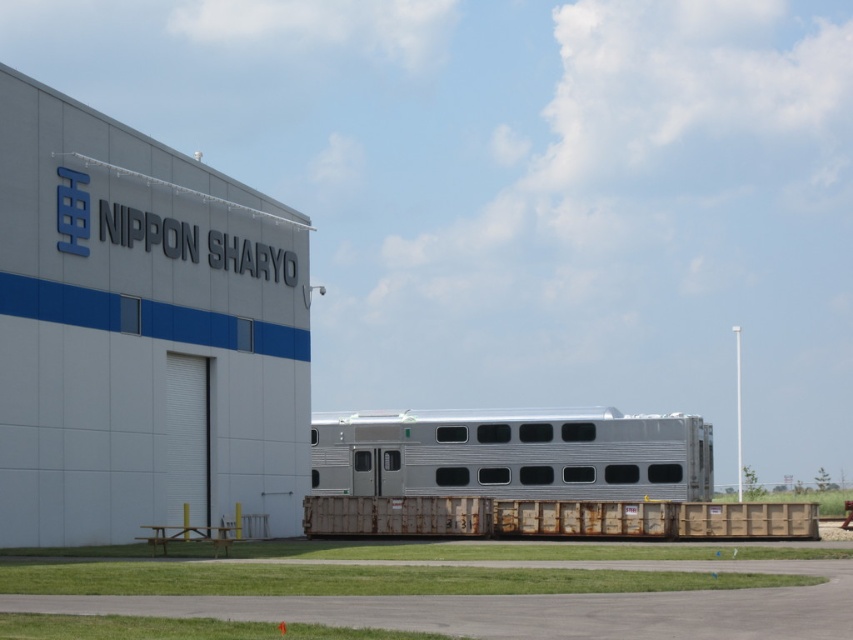
You are a delivery driver arriving at the industrial area and need to park your truck. You see the gray matte building at upper left and the brown wooden train at center. Which object is positioned higher in the image?

The gray matte building at upper left is above the brown wooden train at center in the image.